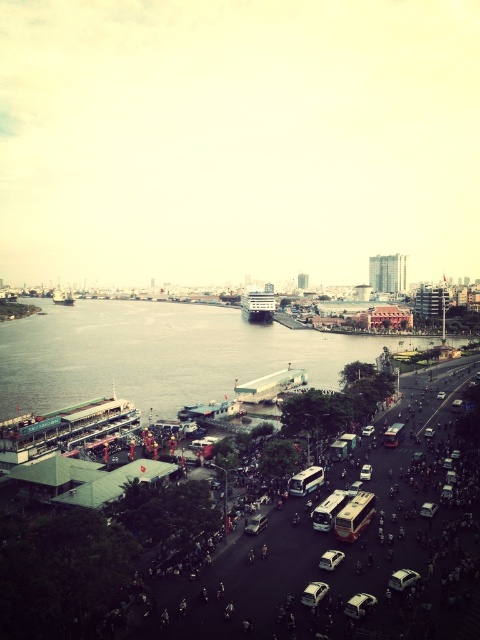
Question: Is gold metallic bus at center positioned at the back of metallic silver bus at center?

Choices:
 (A) no
 (B) yes

Answer: (A)

Question: Among these points, which one is farthest from the camera?

Choices:
 (A) (327, 529)
 (B) (321, 481)

Answer: (B)

Question: Which of these objects is positioned farthest from the white matte bus at center?

Choices:
 (A) gold metallic bus at center
 (B) matte white bus at center
 (C) gray concrete river at center
 (D) metallic silver bus at center

Answer: (C)

Question: Can you confirm if white matte bus at center is smaller than matte white bus at center?

Choices:
 (A) no
 (B) yes

Answer: (B)

Question: Is gold metallic bus at center thinner than metallic silver bus at center?

Choices:
 (A) yes
 (B) no

Answer: (B)

Question: Among these objects, which one is farthest from the camera?

Choices:
 (A) white matte bus at center
 (B) matte white bus at center
 (C) metallic silver bus at center

Answer: (B)